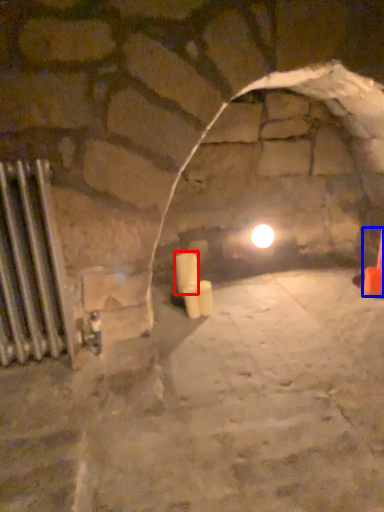
Question: Which object is further to the camera taking this photo, candle (highlighted by a red box) or traffic cone (highlighted by a blue box)?

Choices:
 (A) candle
 (B) traffic cone

Answer: (B)